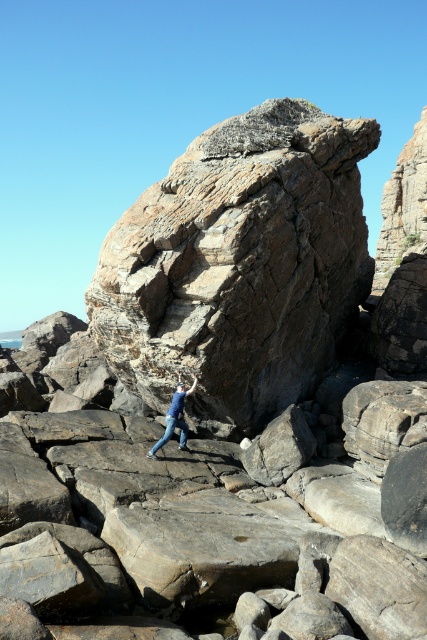
You are a hiker standing at the base of the rusty stone boulder at center. You want to reach the top of it. Given that the boulder is 14.07 meters away from you, can you estimate how far you need to climb vertically?

The question asks about vertical distance, but the provided information only specifies the horizontal distance of 14.07 meters from the viewer to the rusty stone boulder at center. Without knowing the boulder height or the slope angle, it is impossible to calculate the vertical climbing distance.

You are a hiker trying to reach the top of the rusty stone boulder at center. You notice the blue denim jeans at center are in your path. Can you safely step over them while climbing?

The rusty stone boulder at center is above the blue denim jeans at center, so you can safely step over the blue denim jeans at center while climbing.

You are a hiker trying to reach the top of the rusty stone boulder at center. Based on the image, what is the nearest object to your current position at point (239, 264)?

The nearest object to your current position at point (239, 264) is the rusty stone boulder at center itself, as that is where you are located.